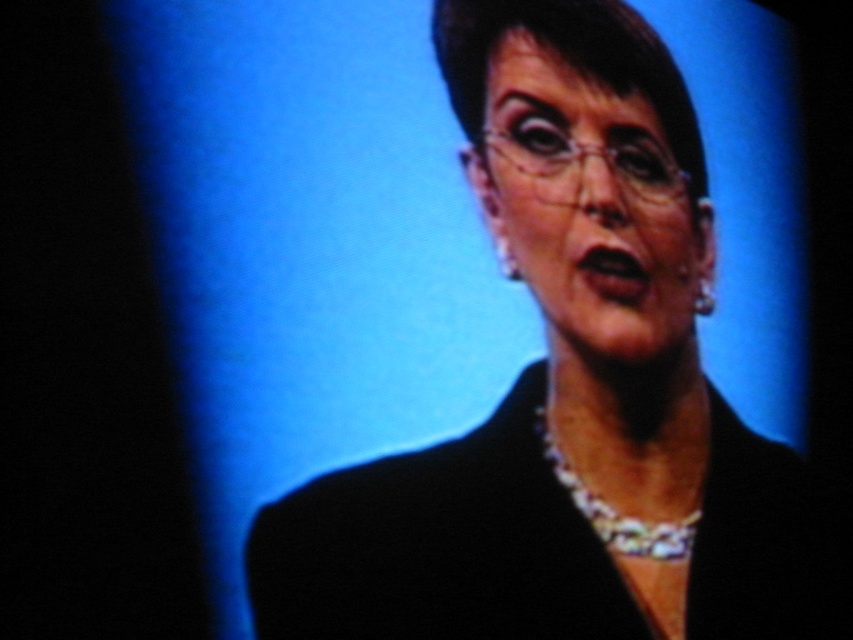
Can you confirm if black glossy suit at center is positioned below matte black face at center?

Yes, black glossy suit at center is below matte black face at center.

Can you confirm if black glossy suit at center is thinner than matte black face at center?

No.

Does point (614, 291) come closer to viewer compared to point (692, 250)?

Yes.

Where is `black glossy suit at center`? The height and width of the screenshot is (640, 853). black glossy suit at center is located at coordinates (572, 392).

Describe the element at coordinates (440, 545) in the screenshot. I see `black matte business suit at center` at that location.

Is black matte business suit at center taller than matte black face at center?

Yes, black matte business suit at center is taller than matte black face at center.

Find the location of `black matte business suit at center`. black matte business suit at center is located at coordinates (440, 545).

Which of these two, black matte business suit at center or silver metallic necklace at center, stands shorter?

silver metallic necklace at center is shorter.

In the scene shown: Does black matte business suit at center have a larger size compared to silver metallic necklace at center?

Correct, black matte business suit at center is larger in size than silver metallic necklace at center.

You are a GUI agent. You are given a task and a screenshot of the screen. Output one action in this format:
    pyautogui.click(x=<x>, y=<y>)
    Task: Click on the black matte business suit at center
    The image size is (853, 640).
    Given the screenshot: What is the action you would take?
    pyautogui.click(x=440, y=545)